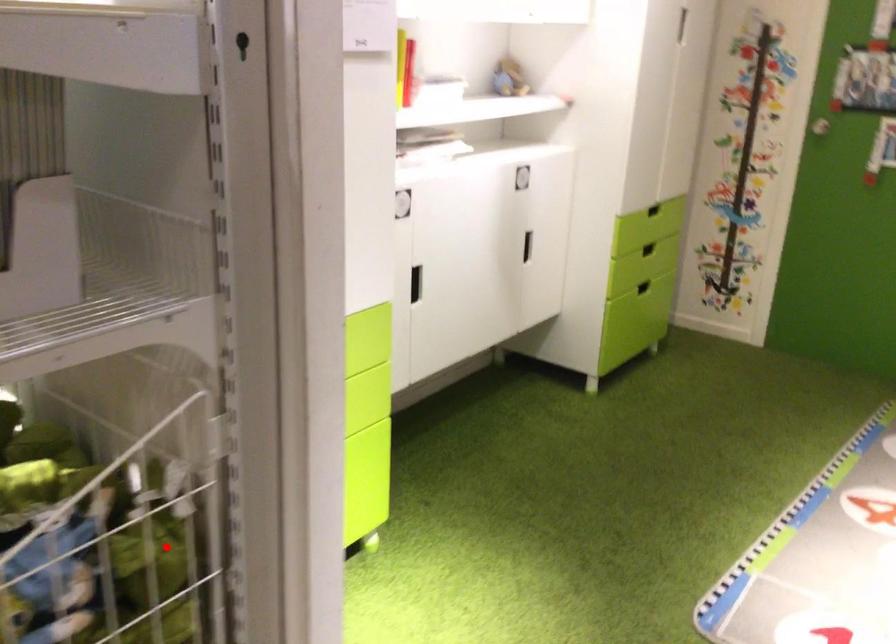
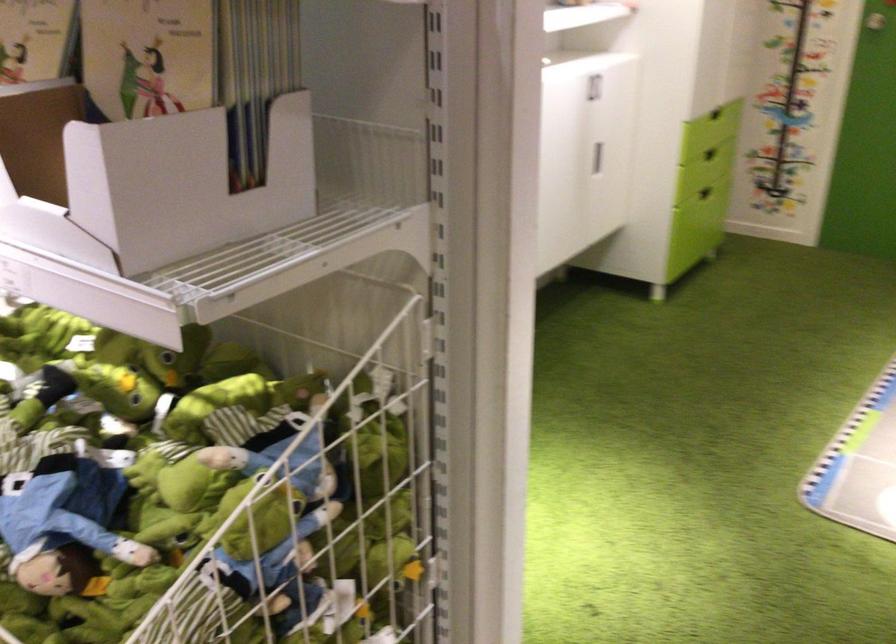
The point at the highlighted location is marked in the first image. Where is the corresponding point in the second image?

(376, 431)